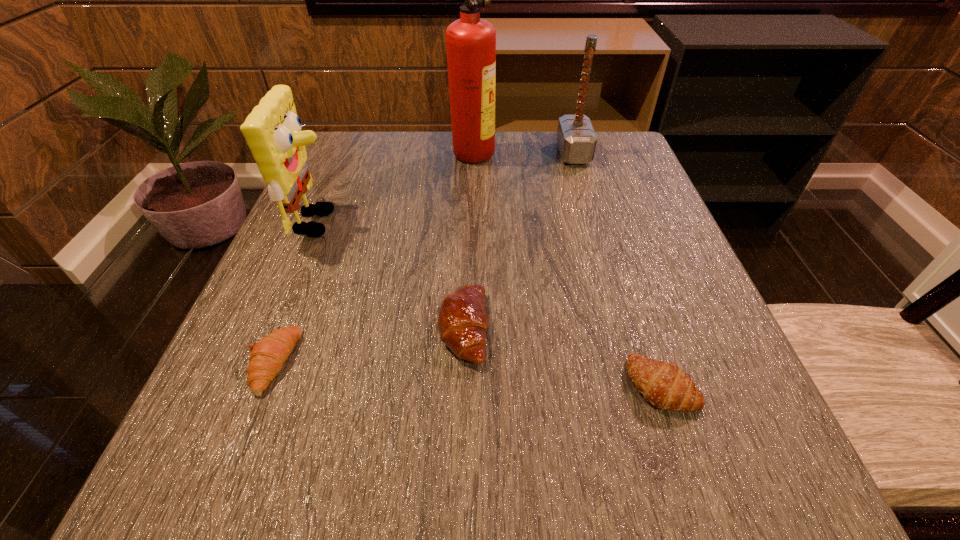
Locate an element on the screen. The image size is (960, 540). fire extinguisher is located at coordinates click(x=470, y=41).

Identify the location of hammer. Image resolution: width=960 pixels, height=540 pixels. (576, 138).

You are a GUI agent. You are given a task and a screenshot of the screen. Output one action in this format:
    pyautogui.click(x=<x>, y=<y>)
    Task: Click on the fourth nearest object
    
    Given the screenshot: What is the action you would take?
    pyautogui.click(x=272, y=130)

Identify the location of the second crescent roll from left to right. This screenshot has width=960, height=540. (462, 321).

Locate an element on the screen. The height and width of the screenshot is (540, 960). the rightmost crescent roll is located at coordinates (664, 385).

Where is `the shortest crescent roll`? the shortest crescent roll is located at coordinates (268, 355).

Locate an element on the screen. This screenshot has height=540, width=960. the shortest object is located at coordinates (268, 355).

What are the coordinates of `vacant region located on the front-facing side of the fire extinguisher` in the screenshot? It's located at (574, 151).

Image resolution: width=960 pixels, height=540 pixels. Identify the location of free spot located on the striking surface of the hammer. (487, 154).

Where is `free space located 0.050m on the striking surface of the hammer`? This screenshot has width=960, height=540. free space located 0.050m on the striking surface of the hammer is located at coordinates (538, 154).